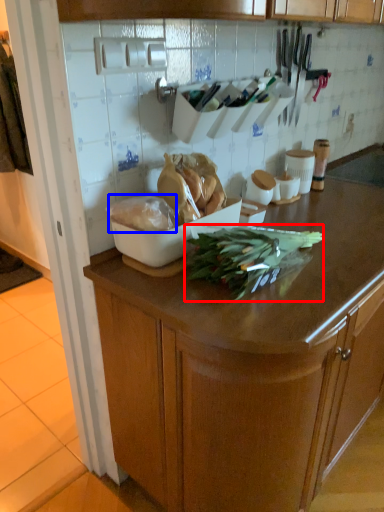
Question: Which object is further to the camera taking this photo, green vegetables (highlighted by a red box) or food (highlighted by a blue box)?

Choices:
 (A) green vegetables
 (B) food

Answer: (B)